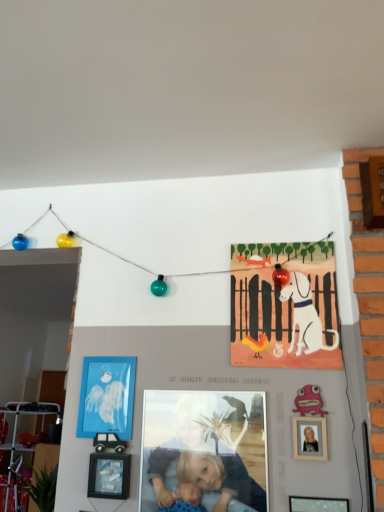
Question: Is smooth skin child at center turned away from matte paper poster at upper center?

Choices:
 (A) no
 (B) yes

Answer: (A)

Question: Is smooth skin child at center thinner than matte paper poster at upper center?

Choices:
 (A) yes
 (B) no

Answer: (B)

Question: Does smooth skin child at center appear on the left side of matte paper poster at upper center?

Choices:
 (A) no
 (B) yes

Answer: (B)

Question: Is smooth skin child at center facing towards matte paper poster at upper center?

Choices:
 (A) no
 (B) yes

Answer: (A)

Question: Does smooth skin child at center appear on the right side of matte paper poster at upper center?

Choices:
 (A) no
 (B) yes

Answer: (A)

Question: Is smooth skin child at center not within matte paper poster at upper center?

Choices:
 (A) yes
 (B) no

Answer: (A)

Question: Is wooden picture frame at lower center, the second picture frame in the bottom-to-top sequence, inside matte black picture frame at lower right, which ranks as the 3th picture frame in top-to-bottom order?

Choices:
 (A) yes
 (B) no

Answer: (B)

Question: Does matte black picture frame at lower right, which is the third picture frame in back-to-front order, have a greater height compared to wooden picture frame at lower center, marked as the 2th picture frame in a left-to-right arrangement?

Choices:
 (A) yes
 (B) no

Answer: (A)

Question: Is matte black picture frame at lower right, which is counted as the 1th picture frame, starting from the right, aimed at wooden picture frame at lower center, positioned as the 2th picture frame in top-to-bottom order?

Choices:
 (A) yes
 (B) no

Answer: (B)

Question: Does matte black picture frame at lower right, the 1th picture frame in the front-to-back sequence, have a greater width compared to wooden picture frame at lower center, marked as the 2th picture frame in a left-to-right arrangement?

Choices:
 (A) no
 (B) yes

Answer: (A)

Question: Considering the relative positions of matte black picture frame at lower right, which ranks as the 3th picture frame in left-to-right order, and wooden picture frame at lower center, which appears as the second picture frame when viewed from the front, in the image provided, is matte black picture frame at lower right, which ranks as the 3th picture frame in left-to-right order, to the right of wooden picture frame at lower center, which appears as the second picture frame when viewed from the front, from the viewer's perspective?

Choices:
 (A) yes
 (B) no

Answer: (A)

Question: Does matte black picture frame at lower right, which is counted as the 1th picture frame, starting from the right, have a lesser height compared to wooden picture frame at lower center, positioned as the 2th picture frame in top-to-bottom order?

Choices:
 (A) no
 (B) yes

Answer: (A)

Question: Can you confirm if smooth skin child at center is bigger than wooden picture frame at lower center, which appears as the second picture frame when viewed from the front?

Choices:
 (A) no
 (B) yes

Answer: (B)